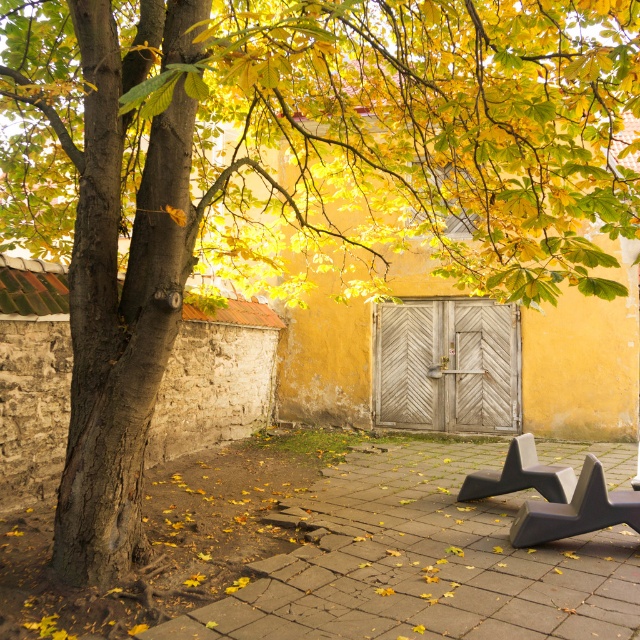
Question: Is smooth concrete bench at lower right further to camera compared to gray concrete bench at center?

Choices:
 (A) yes
 (B) no

Answer: (B)

Question: Does smooth concrete bench at lower right appear under gray concrete bench at center?

Choices:
 (A) no
 (B) yes

Answer: (B)

Question: Can you confirm if smooth concrete bench at lower right is positioned above gray concrete bench at center?

Choices:
 (A) no
 (B) yes

Answer: (A)

Question: Which point is farther from the camera taking this photo?

Choices:
 (A) (308, 579)
 (B) (531, 481)

Answer: (B)